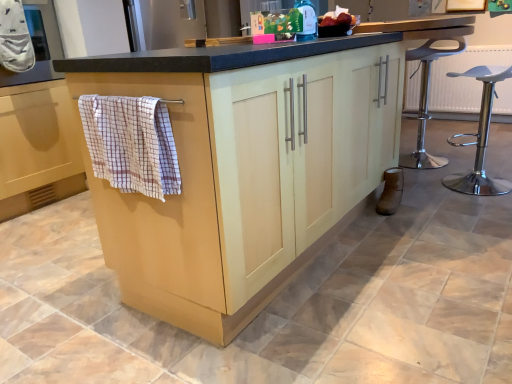
Question: Is white plastic stool at right wider or thinner than brown suede boot at lower right?

Choices:
 (A) thin
 (B) wide

Answer: (B)

Question: From a real-world perspective, relative to brown suede boot at lower right, is white plastic stool at right vertically above or below?

Choices:
 (A) above
 (B) below

Answer: (A)

Question: Which object is the farthest from the white cotton oven mitt at upper left, the 1th bath towel viewed from the left?

Choices:
 (A) brown suede boot at lower right
 (B) green matte bottle at upper center
 (C) matte gray oven at upper left
 (D) checkered fabric bath towel at left, arranged as the 1th bath towel when viewed from the front
 (E) white plastic stool at right

Answer: (E)

Question: Considering the real-world distances, which object is closest to the checkered fabric bath towel at left, acting as the 1th bath towel starting from the bottom?

Choices:
 (A) white plastic stool at right
 (B) green matte bottle at upper center
 (C) brown suede boot at lower right
 (D) white cotton oven mitt at upper left, the 1th bath towel viewed from the left
 (E) matte gray oven at upper left

Answer: (B)